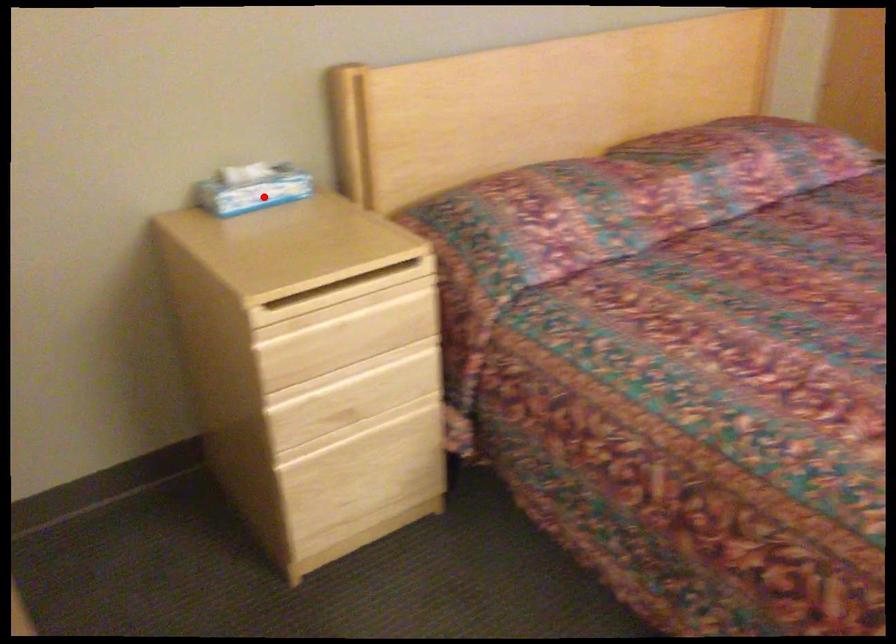
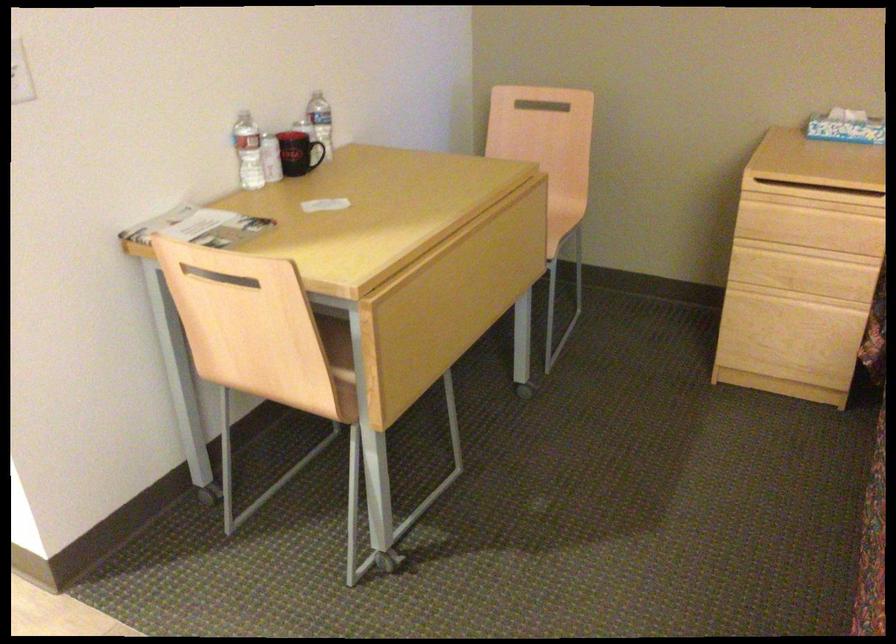
Question: I am providing you with two images of the same scene from different viewpoints. In image1, a red point is highlighted. Considering the same 3D point in image2, which of the following is correct?

Choices:
 (A) It is closer
 (B) It is farther

Answer: (B)